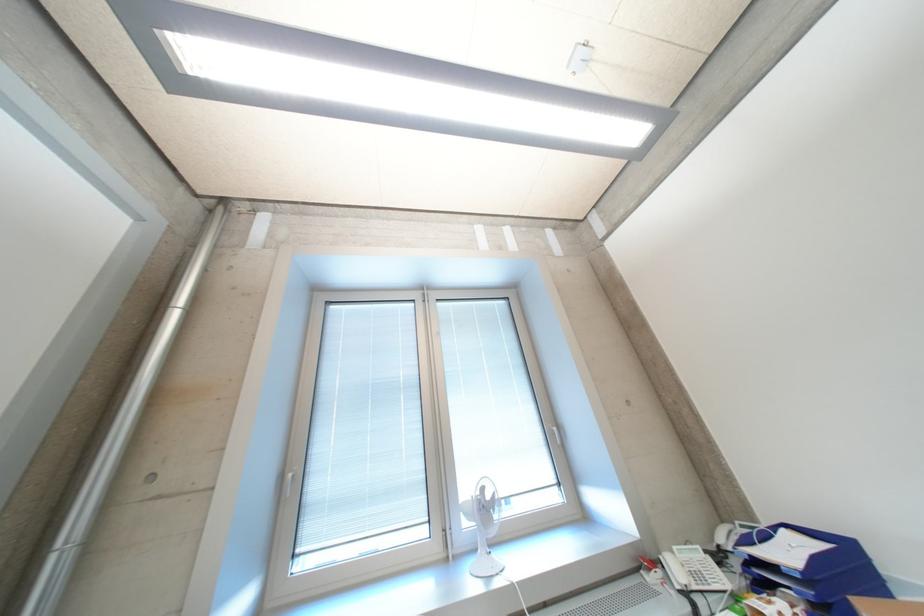
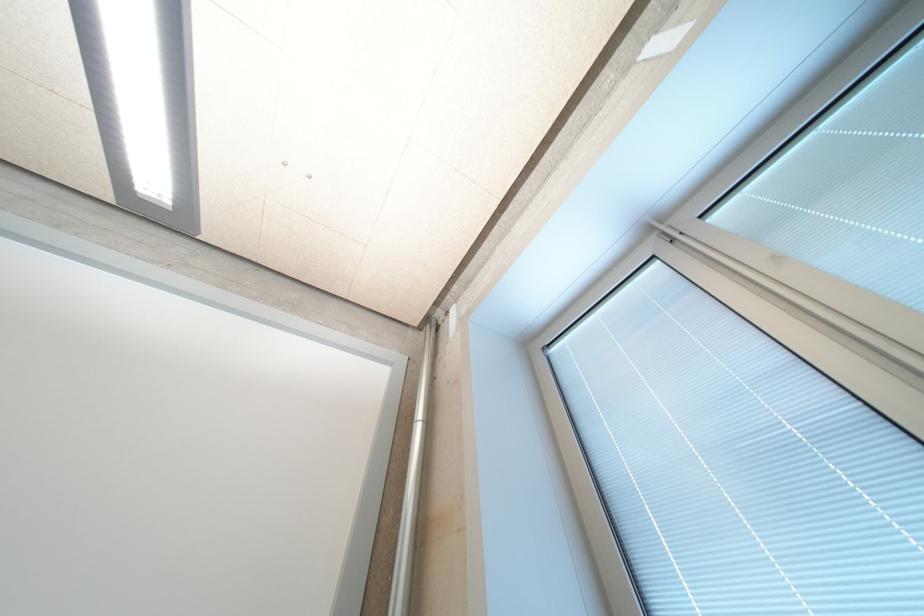
Consider the image. The first image is from the beginning of the video and the second image is from the end. How did the camera likely rotate when shooting the video?

The camera's rotation is toward left-up.